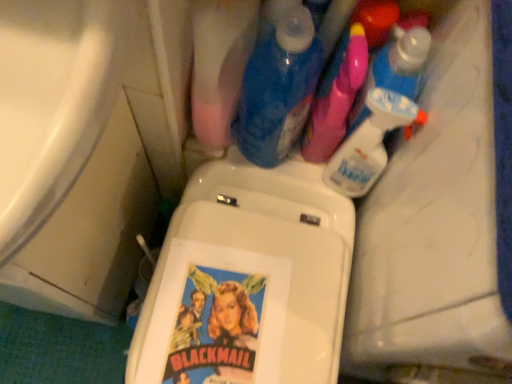
Find the location of a particular element. The width and height of the screenshot is (512, 384). translucent plastic spray bottle at upper right, which ranks as the fourth cleaning product in left-to-right order is located at coordinates (395, 66).

Describe the element at coordinates (278, 89) in the screenshot. This screenshot has height=384, width=512. I see `blue glossy bottle at upper center, acting as the 4th cleaning product starting from the right` at that location.

This screenshot has height=384, width=512. I want to click on pink plastic spray bottle at upper right, which is the 2th cleaning product in left-to-right order, so click(336, 96).

Locate an element on the screen. This screenshot has height=384, width=512. the 1st cleaning product positioned above the white glossy bathtub at lower left (from the image's perspective) is located at coordinates coord(370,142).

How many degrees apart are the facing directions of clear plastic spray bottle at upper right, which appears as the 2th cleaning product when viewed from the right, and white glossy bathtub at lower left?

1.1 degrees.

Is clear plastic spray bottle at upper right, which appears as the 2th cleaning product when viewed from the right, in front of white glossy bathtub at lower left?

No.

Could you tell me if clear plastic spray bottle at upper right, the 3th cleaning product in the left-to-right sequence, is turned towards white glossy bathtub at lower left?

No, clear plastic spray bottle at upper right, the 3th cleaning product in the left-to-right sequence, does not turn towards white glossy bathtub at lower left.

Between pink plastic spray bottle at upper right, the third cleaning product viewed from the right, and translucent plastic spray bottle at upper right, positioned as the 1th cleaning product in right-to-left order, which one appears on the right side from the viewer's perspective?

translucent plastic spray bottle at upper right, positioned as the 1th cleaning product in right-to-left order.

Can you see pink plastic spray bottle at upper right, the third cleaning product viewed from the right, touching translucent plastic spray bottle at upper right, positioned as the 1th cleaning product in right-to-left order?

Yes, pink plastic spray bottle at upper right, the third cleaning product viewed from the right, is with translucent plastic spray bottle at upper right, positioned as the 1th cleaning product in right-to-left order.

From a real-world perspective, is pink plastic spray bottle at upper right, the third cleaning product viewed from the right, beneath translucent plastic spray bottle at upper right, which ranks as the fourth cleaning product in left-to-right order?

Indeed, from a real-world perspective, pink plastic spray bottle at upper right, the third cleaning product viewed from the right, is positioned beneath translucent plastic spray bottle at upper right, which ranks as the fourth cleaning product in left-to-right order.

Between pink plastic spray bottle at upper right, the third cleaning product viewed from the right, and translucent plastic spray bottle at upper right, which ranks as the fourth cleaning product in left-to-right order, which one has larger size?

pink plastic spray bottle at upper right, the third cleaning product viewed from the right, is bigger.

Where is `cleaning product that is the 2nd one when counting forward from the translucent plastic spray bottle at upper right, positioned as the 1th cleaning product in right-to-left order`? The width and height of the screenshot is (512, 384). cleaning product that is the 2nd one when counting forward from the translucent plastic spray bottle at upper right, positioned as the 1th cleaning product in right-to-left order is located at coordinates (370, 142).

Who is taller, clear plastic spray bottle at upper right, the 3th cleaning product in the left-to-right sequence, or translucent plastic spray bottle at upper right, which ranks as the fourth cleaning product in left-to-right order?

translucent plastic spray bottle at upper right, which ranks as the fourth cleaning product in left-to-right order, is taller.

Is clear plastic spray bottle at upper right, the 3th cleaning product in the left-to-right sequence, completely or partially outside of translucent plastic spray bottle at upper right, which ranks as the fourth cleaning product in left-to-right order?

Yes, clear plastic spray bottle at upper right, the 3th cleaning product in the left-to-right sequence, is located beyond the bounds of translucent plastic spray bottle at upper right, which ranks as the fourth cleaning product in left-to-right order.

From a real-world perspective, between clear plastic spray bottle at upper right, which appears as the 2th cleaning product when viewed from the right, and translucent plastic spray bottle at upper right, which ranks as the fourth cleaning product in left-to-right order, who is vertically higher?

In real-world perspective, translucent plastic spray bottle at upper right, which ranks as the fourth cleaning product in left-to-right order, is above.

From a real-world perspective, is white glossy bathtub at lower left positioned under blue glossy bottle at upper center, acting as the 4th cleaning product starting from the right, based on gravity?

Indeed, from a real-world perspective, white glossy bathtub at lower left is positioned beneath blue glossy bottle at upper center, acting as the 4th cleaning product starting from the right.

Which is in front, white glossy bathtub at lower left or blue glossy bottle at upper center, acting as the 4th cleaning product starting from the right?

white glossy bathtub at lower left.

Is blue glossy bottle at upper center, acting as the 4th cleaning product starting from the right, located within white glossy bathtub at lower left?

No, blue glossy bottle at upper center, acting as the 4th cleaning product starting from the right, is not surrounded by white glossy bathtub at lower left.

Which cleaning product is the 1st one when counting from the right side of the white glossy bathtub at lower left? Please provide its 2D coordinates.

[(278, 89)]

Which object is wider, translucent plastic spray bottle at upper right, positioned as the 1th cleaning product in right-to-left order, or clear plastic spray bottle at upper right, which appears as the 2th cleaning product when viewed from the right?

With larger width is translucent plastic spray bottle at upper right, positioned as the 1th cleaning product in right-to-left order.

Is translucent plastic spray bottle at upper right, positioned as the 1th cleaning product in right-to-left order, to the left of clear plastic spray bottle at upper right, the 3th cleaning product in the left-to-right sequence, from the viewer's perspective?

No, translucent plastic spray bottle at upper right, positioned as the 1th cleaning product in right-to-left order, is not to the left of clear plastic spray bottle at upper right, the 3th cleaning product in the left-to-right sequence.

Does translucent plastic spray bottle at upper right, which ranks as the fourth cleaning product in left-to-right order, have a greater height compared to clear plastic spray bottle at upper right, the 3th cleaning product in the left-to-right sequence?

Yes.

Which of these two, translucent plastic spray bottle at upper right, positioned as the 1th cleaning product in right-to-left order, or clear plastic spray bottle at upper right, which appears as the 2th cleaning product when viewed from the right, is smaller?

clear plastic spray bottle at upper right, which appears as the 2th cleaning product when viewed from the right.

From the image's perspective, between blue glossy bottle at upper center, the first cleaning product positioned from the left, and pink plastic spray bottle at upper right, the third cleaning product viewed from the right, which one is located above?

blue glossy bottle at upper center, the first cleaning product positioned from the left.

Is blue glossy bottle at upper center, acting as the 4th cleaning product starting from the right, in front of pink plastic spray bottle at upper right, which is the 2th cleaning product in left-to-right order?

Yes, it is.

Looking at this image, is blue glossy bottle at upper center, acting as the 4th cleaning product starting from the right, facing towards pink plastic spray bottle at upper right, the third cleaning product viewed from the right?

No, blue glossy bottle at upper center, acting as the 4th cleaning product starting from the right, is not oriented towards pink plastic spray bottle at upper right, the third cleaning product viewed from the right.

Does point (313, 63) lie in front of point (360, 59)?

Yes, point (313, 63) is in front of point (360, 59).

Between pink plastic spray bottle at upper right, the third cleaning product viewed from the right, and blue glossy bottle at upper center, the first cleaning product positioned from the left, which one appears on the right side from the viewer's perspective?

pink plastic spray bottle at upper right, the third cleaning product viewed from the right.

In the scene shown: Is the depth of pink plastic spray bottle at upper right, which is the 2th cleaning product in left-to-right order, greater than that of blue glossy bottle at upper center, acting as the 4th cleaning product starting from the right?

Yes, pink plastic spray bottle at upper right, which is the 2th cleaning product in left-to-right order, is further from the viewer.

Would you say pink plastic spray bottle at upper right, the third cleaning product viewed from the right, is a long distance from blue glossy bottle at upper center, acting as the 4th cleaning product starting from the right?

No, pink plastic spray bottle at upper right, the third cleaning product viewed from the right, is not far from blue glossy bottle at upper center, acting as the 4th cleaning product starting from the right.

From a real-world perspective, is pink plastic spray bottle at upper right, which is the 2th cleaning product in left-to-right order, on blue glossy bottle at upper center, acting as the 4th cleaning product starting from the right?

Incorrect, from a real-world perspective, pink plastic spray bottle at upper right, which is the 2th cleaning product in left-to-right order, is lower than blue glossy bottle at upper center, acting as the 4th cleaning product starting from the right.

Where is `bath that appears in front of the clear plastic spray bottle at upper right, the 3th cleaning product in the left-to-right sequence`? bath that appears in front of the clear plastic spray bottle at upper right, the 3th cleaning product in the left-to-right sequence is located at coordinates (50, 104).

Locate an element on the screen. cleaning product behind the pink plastic spray bottle at upper right, the third cleaning product viewed from the right is located at coordinates (395, 66).

Which object lies nearer to the anchor point blue glossy bottle at upper center, acting as the 4th cleaning product starting from the right, translucent plastic spray bottle at upper right, which ranks as the fourth cleaning product in left-to-right order, or white glossy bathtub at lower left?

translucent plastic spray bottle at upper right, which ranks as the fourth cleaning product in left-to-right order, is positioned closer to the anchor blue glossy bottle at upper center, acting as the 4th cleaning product starting from the right.

When comparing their distances from blue glossy bottle at upper center, acting as the 4th cleaning product starting from the right, does clear plastic spray bottle at upper right, the 3th cleaning product in the left-to-right sequence, or white glossy bathtub at lower left seem further?

The object further to blue glossy bottle at upper center, acting as the 4th cleaning product starting from the right, is white glossy bathtub at lower left.

Based on the photo, considering their positions, is translucent plastic spray bottle at upper right, which ranks as the fourth cleaning product in left-to-right order, positioned closer to clear plastic spray bottle at upper right, which appears as the 2th cleaning product when viewed from the right, than white glossy bathtub at lower left?

translucent plastic spray bottle at upper right, which ranks as the fourth cleaning product in left-to-right order.

Estimate the real-world distances between objects in this image. Which object is further from clear plastic spray bottle at upper right, which appears as the 2th cleaning product when viewed from the right, pink plastic spray bottle at upper right, the third cleaning product viewed from the right, or blue glossy bottle at upper center, acting as the 4th cleaning product starting from the right?

blue glossy bottle at upper center, acting as the 4th cleaning product starting from the right, lies further to clear plastic spray bottle at upper right, which appears as the 2th cleaning product when viewed from the right, than the other object.

Considering their positions, is pink plastic spray bottle at upper right, the third cleaning product viewed from the right, positioned closer to clear plastic spray bottle at upper right, which appears as the 2th cleaning product when viewed from the right, than translucent plastic spray bottle at upper right, which ranks as the fourth cleaning product in left-to-right order?

Among the two, translucent plastic spray bottle at upper right, which ranks as the fourth cleaning product in left-to-right order, is located nearer to clear plastic spray bottle at upper right, which appears as the 2th cleaning product when viewed from the right.

From the picture: When comparing their distances from pink plastic spray bottle at upper right, which is the 2th cleaning product in left-to-right order, does blue glossy bottle at upper center, acting as the 4th cleaning product starting from the right, or clear plastic spray bottle at upper right, which appears as the 2th cleaning product when viewed from the right, seem further?

blue glossy bottle at upper center, acting as the 4th cleaning product starting from the right.

Estimate the real-world distances between objects in this image. Which object is further from white glossy bathtub at lower left, pink plastic spray bottle at upper right, which is the 2th cleaning product in left-to-right order, or blue glossy bottle at upper center, acting as the 4th cleaning product starting from the right?

pink plastic spray bottle at upper right, which is the 2th cleaning product in left-to-right order.

Looking at the image, which one is located further to white glossy bathtub at lower left, blue glossy bottle at upper center, the first cleaning product positioned from the left, or pink plastic spray bottle at upper right, the third cleaning product viewed from the right?

Based on the image, pink plastic spray bottle at upper right, the third cleaning product viewed from the right, appears to be further to white glossy bathtub at lower left.

Image resolution: width=512 pixels, height=384 pixels. Identify the location of cleaning product between blue glossy bottle at upper center, acting as the 4th cleaning product starting from the right, and clear plastic spray bottle at upper right, the 3th cleaning product in the left-to-right sequence. (336, 96).

Find the location of `cleaning product between white glossy bathtub at lower left and pink plastic spray bottle at upper right, the third cleaning product viewed from the right`. cleaning product between white glossy bathtub at lower left and pink plastic spray bottle at upper right, the third cleaning product viewed from the right is located at coordinates (278, 89).

This screenshot has height=384, width=512. In order to click on cleaning product between translucent plastic spray bottle at upper right, which ranks as the fourth cleaning product in left-to-right order, and clear plastic spray bottle at upper right, which appears as the 2th cleaning product when viewed from the right, vertically in this screenshot , I will do `click(336, 96)`.